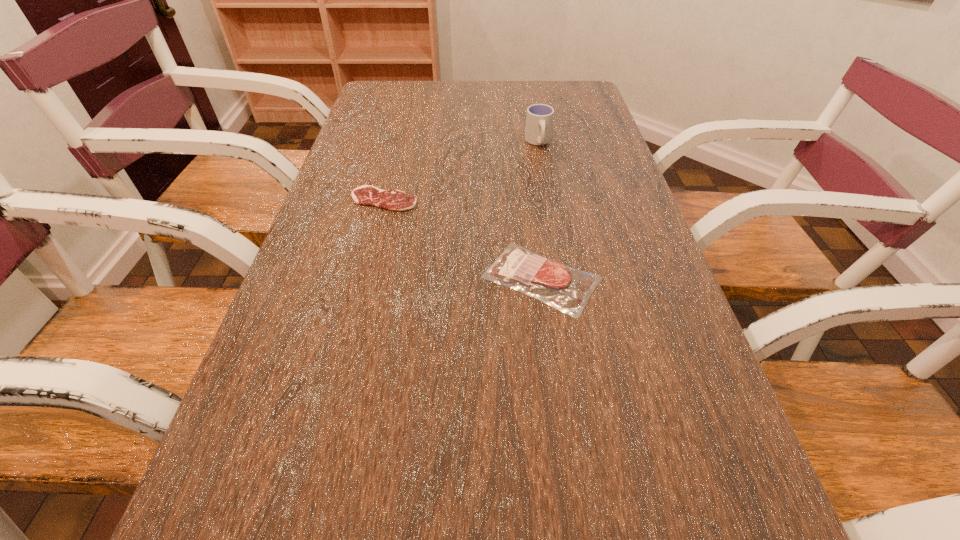
Find the location of a particular element. the farthest object is located at coordinates (539, 120).

Locate an element on the screen. This screenshot has width=960, height=540. the tallest object is located at coordinates (539, 120).

Where is `the right steak`? This screenshot has width=960, height=540. the right steak is located at coordinates (567, 289).

Identify the location of the nearer steak. This screenshot has height=540, width=960. (567, 289).

This screenshot has height=540, width=960. What are the coordinates of `the second farthest object` in the screenshot? It's located at (368, 195).

You are a GUI agent. You are given a task and a screenshot of the screen. Output one action in this format:
    pyautogui.click(x=<x>, y=<y>)
    Task: Click on the farther steak
    This screenshot has height=540, width=960.
    Given the screenshot: What is the action you would take?
    pyautogui.click(x=368, y=195)

Image resolution: width=960 pixels, height=540 pixels. What are the coordinates of `vacant area situated with the handle on the side of the tallest object` in the screenshot? It's located at (556, 242).

Where is `free point located on the back of the second tallest object`? This screenshot has height=540, width=960. free point located on the back of the second tallest object is located at coordinates (532, 205).

Where is `vacant space located 0.260m on the front of the farther steak`? vacant space located 0.260m on the front of the farther steak is located at coordinates point(360,294).

At what (x,y) coordinates should I click in order to perform the action: click on object at the left edge. Please return your answer as a coordinate pair (x, y). Image resolution: width=960 pixels, height=540 pixels. Looking at the image, I should click on (368, 195).